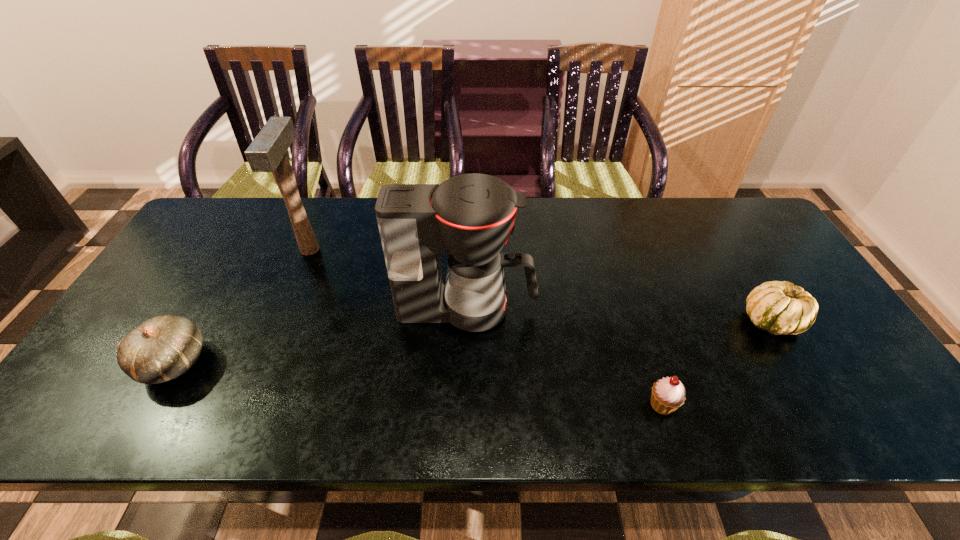
The width and height of the screenshot is (960, 540). Find the location of `vacant space at the far right corner of the desktop`. vacant space at the far right corner of the desktop is located at coordinates (752, 224).

Where is `vacant point located between the coffee maker and the rightmost object`? vacant point located between the coffee maker and the rightmost object is located at coordinates (620, 315).

The image size is (960, 540). Find the location of `vacant space in between the leftmost object and the right gourd`. vacant space in between the leftmost object and the right gourd is located at coordinates (472, 342).

Identify the location of free area in between the third object from left to right and the mallet. The height and width of the screenshot is (540, 960). click(389, 279).

The height and width of the screenshot is (540, 960). I want to click on free space between the leftmost object and the second object from right to left, so click(x=418, y=383).

Identify the location of free point between the leftmost object and the rightmost object. (472, 342).

Identify the location of unoccupied area between the mallet and the right gourd. (540, 285).

Locate an element on the screen. Image resolution: width=960 pixels, height=540 pixels. vacant area that lies between the second object from left to right and the third object from left to right is located at coordinates (389, 279).

This screenshot has height=540, width=960. I want to click on free space that is in between the rightmost object and the mallet, so click(x=540, y=285).

Locate an element on the screen. This screenshot has width=960, height=540. object that is the fourth closest one to the leftmost object is located at coordinates (780, 308).